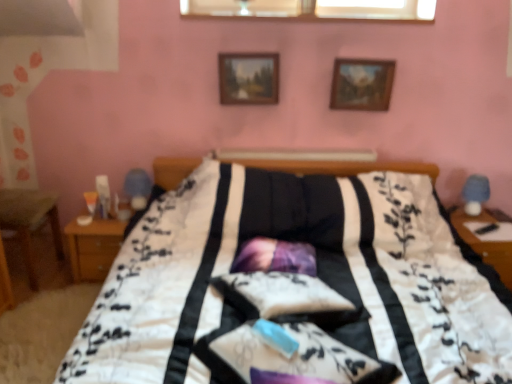
Identify the location of free region on the left part of blue fabric table lamp at right. The height and width of the screenshot is (384, 512). (456, 216).